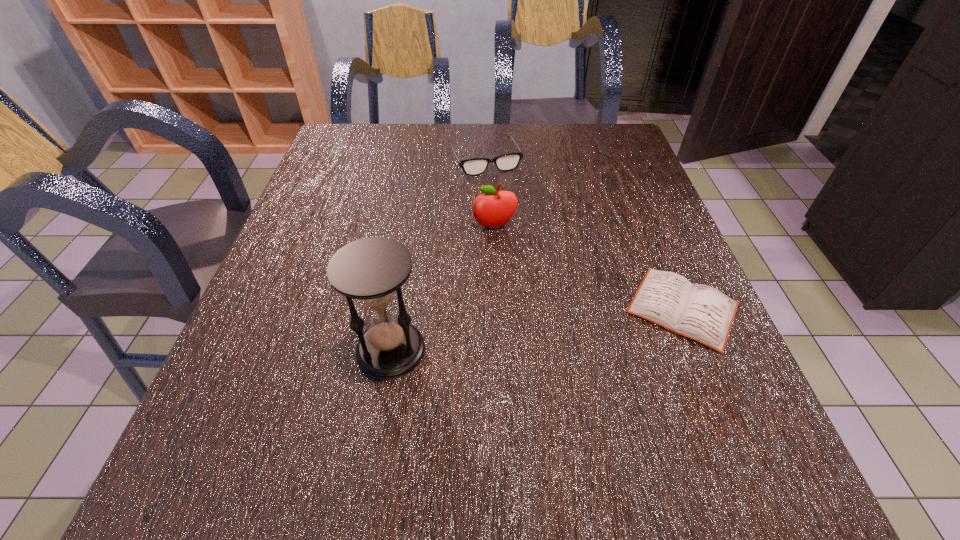
The height and width of the screenshot is (540, 960). Identify the location of vacant space on the desktop that is between the hourglass and the diary and is positioned on the front-facing side of the third shortest object. (520, 331).

Locate an element on the screen. vacant space on the desktop that is between the tallest object and the shortest object and is positioned on the front-facing side of the third tallest object is located at coordinates (567, 325).